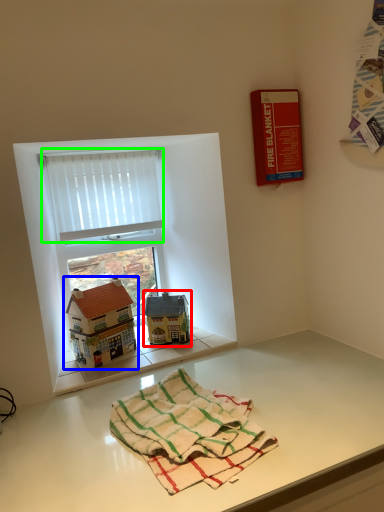
Question: Considering the real-world distances, which object is farthest from toy (highlighted by a red box)? toy (highlighted by a blue box) or curtain (highlighted by a green box)?

Choices:
 (A) toy
 (B) curtain

Answer: (B)